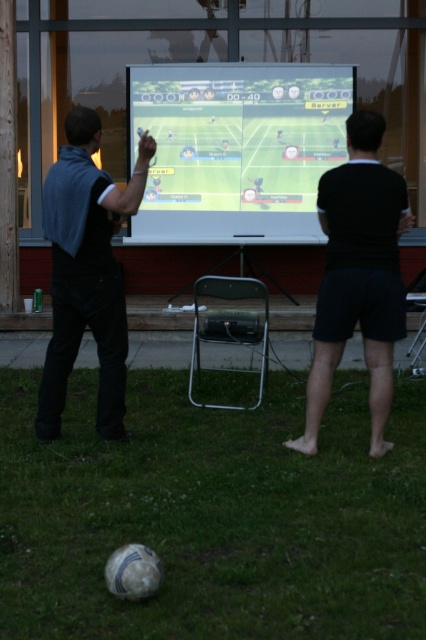
Consider the image. Does white glossy projection screen at center have a larger size compared to black matte shorts at center?

Yes, white glossy projection screen at center is bigger than black matte shorts at center.

Who is more distant from viewer, [259,161] or [302,435]?

The point [259,161] is behind.

Where is `white glossy projection screen at center`? The height and width of the screenshot is (640, 426). white glossy projection screen at center is located at coordinates (236, 148).

Which is above, white glossy projection screen at center or dark blue fabric at left?

Positioned higher is white glossy projection screen at center.

How distant is white glossy projection screen at center from dark blue fabric at left?

They are 4.07 meters apart.

Measure the distance between point (261, 90) and camera.

Point (261, 90) is 8.79 meters away from camera.

Where is `white glossy projection screen at center`? white glossy projection screen at center is located at coordinates (236, 148).

Is black matte shorts at center taller than dark blue fabric at left?

No.

Who is more forward, (x=314, y=364) or (x=71, y=113)?

Point (x=71, y=113) is more forward.

Identify the location of black matte shorts at center. Image resolution: width=426 pixels, height=640 pixels. (359, 276).